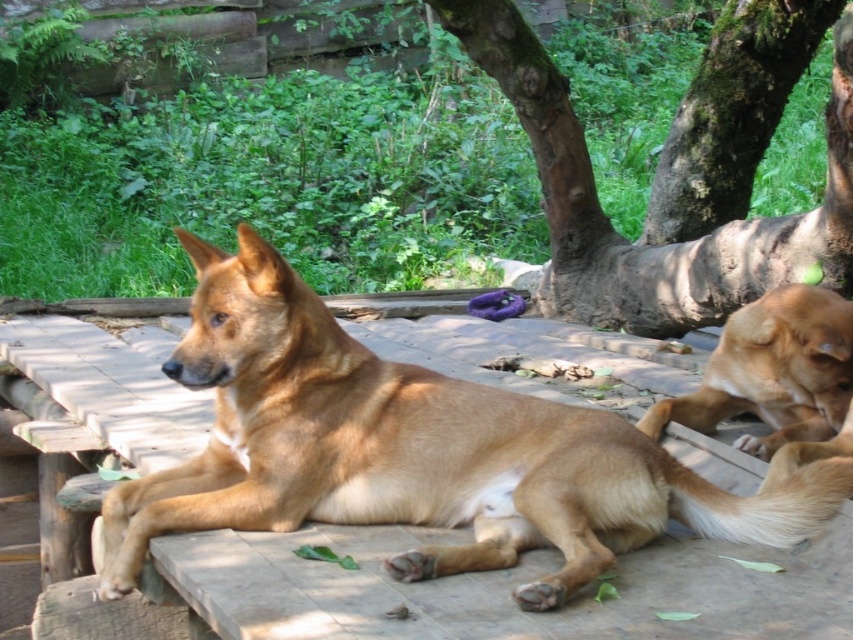
Between brown rough bark tree at upper center and golden fur dog at right, which one has less height?

Standing shorter between the two is golden fur dog at right.

Between brown rough bark tree at upper center and golden fur dog at right, which one appears on the right side from the viewer's perspective?

From the viewer's perspective, brown rough bark tree at upper center appears more on the right side.

At what (x,y) coordinates should I click in order to perform the action: click on brown rough bark tree at upper center. Please return your answer as a coordinate pair (x, y). Looking at the image, I should click on (677, 170).

Where is `brown rough bark tree at upper center`? brown rough bark tree at upper center is located at coordinates (677, 170).

Does golden fur dog at center appear on the left side of brown rough bark tree at upper center?

Yes, golden fur dog at center is to the left of brown rough bark tree at upper center.

Who is more forward, (590, 573) or (753, 49)?

Positioned in front is point (590, 573).

Find the location of a particular element. This screenshot has width=853, height=640. golden fur dog at center is located at coordinates (416, 451).

Who is shorter, golden fur dog at center or golden fur dog at right?

golden fur dog at right is shorter.

Is golden fur dog at center smaller than golden fur dog at right?

No.

Locate an element on the screen. golden fur dog at center is located at coordinates (416, 451).

Where is `golden fur dog at center`? Image resolution: width=853 pixels, height=640 pixels. golden fur dog at center is located at coordinates (416, 451).